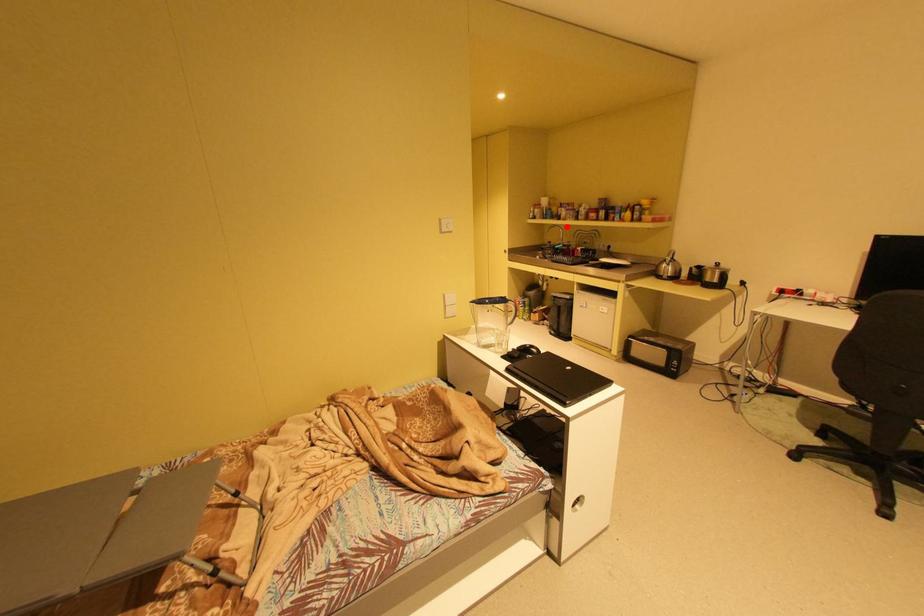
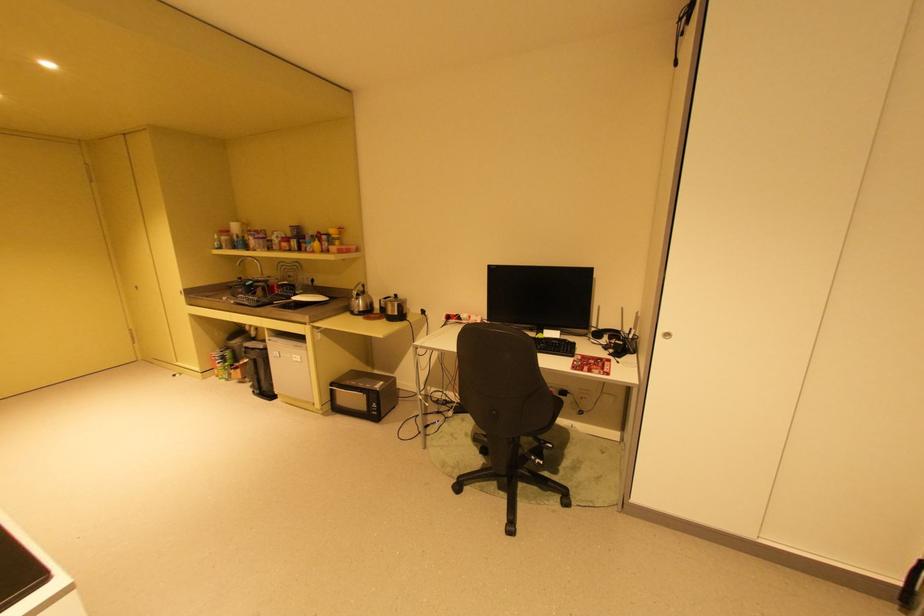
Where in the second image is the point corresponding to the highlighted location from the first image?

(257, 259)